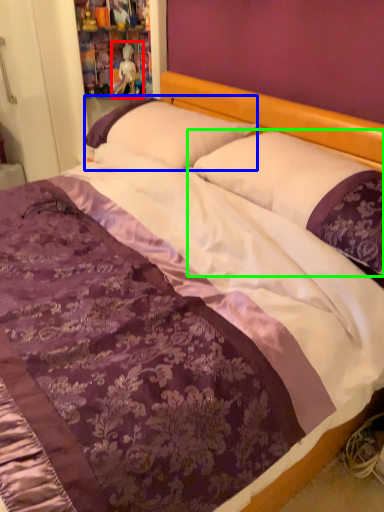
Question: Considering the real-world distances, which object is closest to doll (highlighted by a red box)? pillow (highlighted by a blue box) or pillow (highlighted by a green box).

Choices:
 (A) pillow
 (B) pillow

Answer: (A)